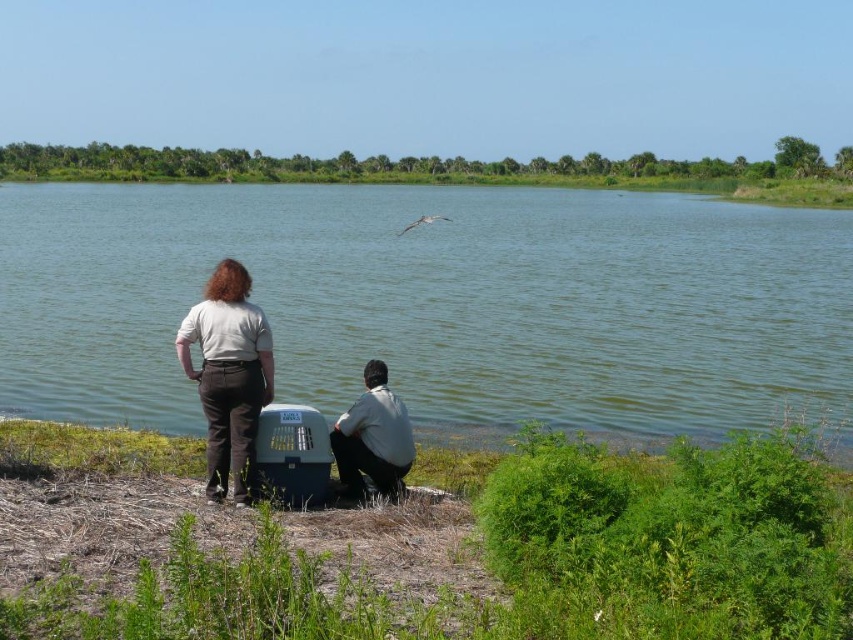
Can you confirm if green water at center is smaller than light gray shirt at lower center?

Incorrect, green water at center is not smaller in size than light gray shirt at lower center.

Who is more distant from viewer, (289,259) or (381,449)?

Point (289,259)

The width and height of the screenshot is (853, 640). Identify the location of green water at center. (438, 305).

Which is more to the right, green water at center or light gray cotton shirt at center?

light gray cotton shirt at center

Which is in front, point (33, 380) or point (230, 392)?

Point (230, 392) is in front.

Does point (113, 243) come closer to viewer compared to point (239, 410)?

No, it is not.

In order to click on green water at center in this screenshot , I will do `click(438, 305)`.

In the scene shown: Can you confirm if light gray cotton shirt at center is positioned above light gray shirt at lower center?

Yes.

Is light gray cotton shirt at center to the left of light gray shirt at lower center from the viewer's perspective?

Correct, you'll find light gray cotton shirt at center to the left of light gray shirt at lower center.

Measure the distance between point (265, 364) and camera.

The distance of point (265, 364) from camera is 23.03 feet.

The height and width of the screenshot is (640, 853). In order to click on light gray cotton shirt at center in this screenshot , I will do `click(228, 372)`.